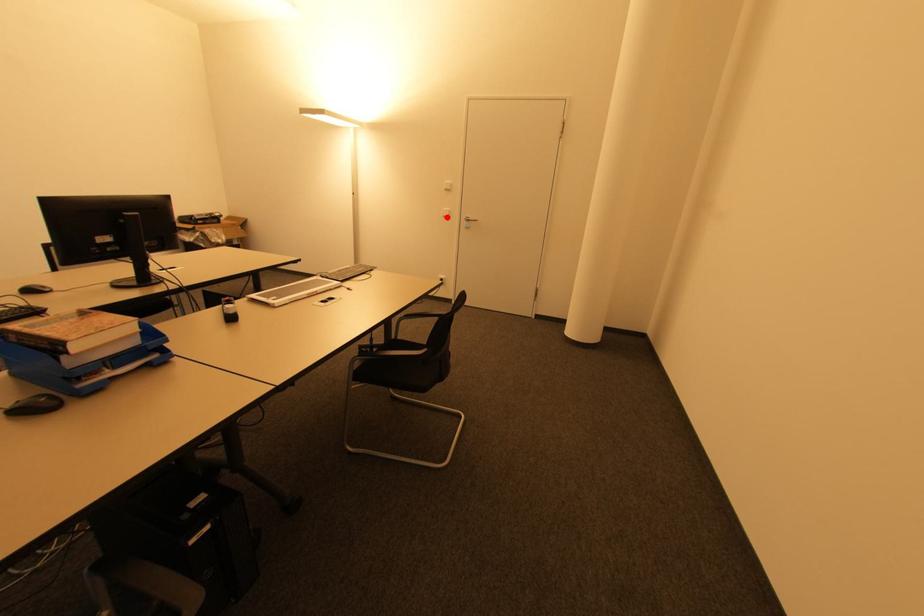
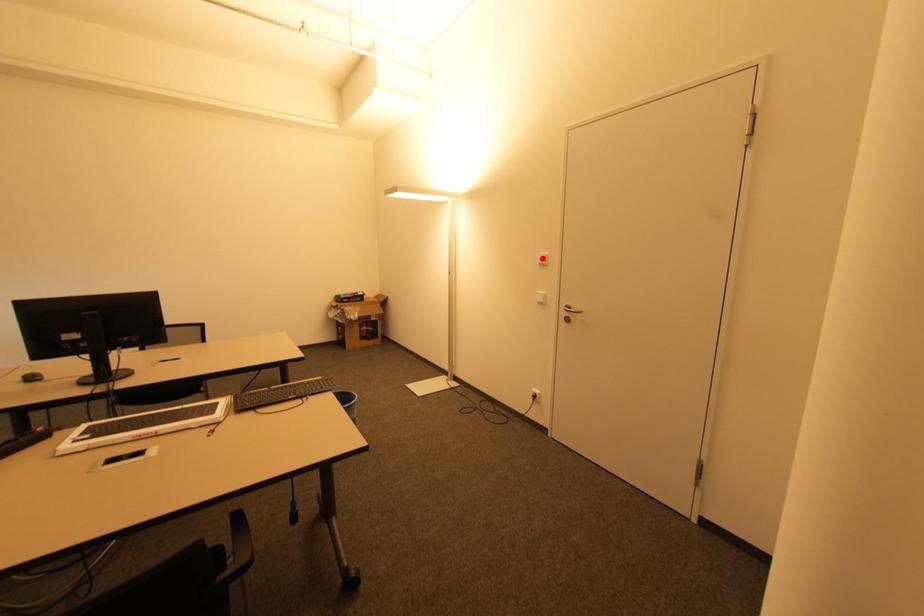
I am providing you with two images of the same scene from different viewpoints. A red point is marked on the first image and another point is marked on the second image. Do the highlighted points in image1 and image2 indicate the same real-world spot?

No